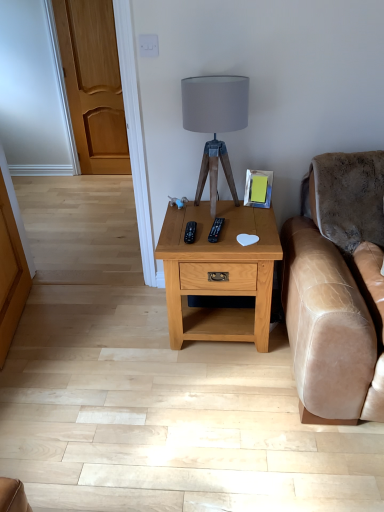
The image size is (384, 512). In order to click on empty space that is ontop of light brown wood nightstand at center (from a real-world perspective) in this screenshot , I will do `click(220, 217)`.